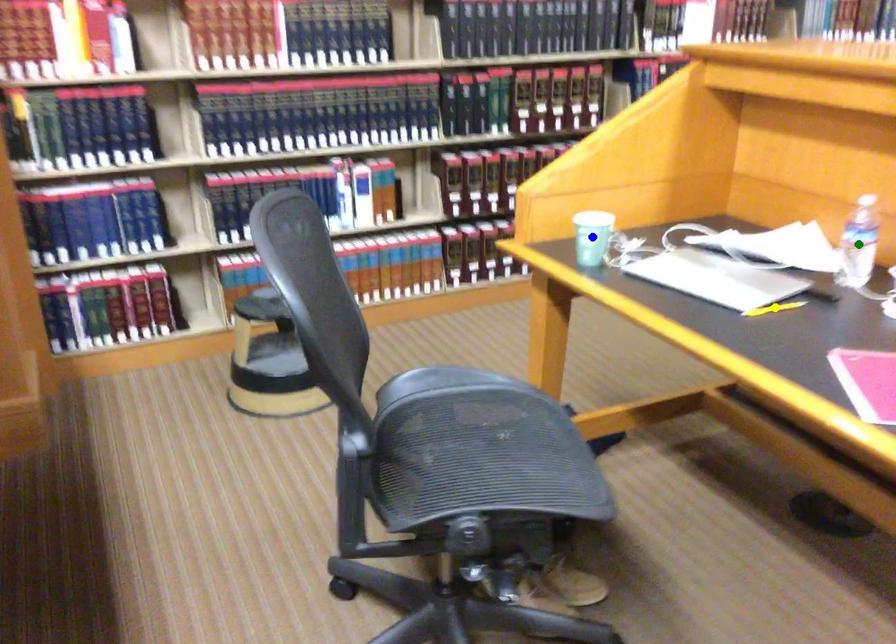
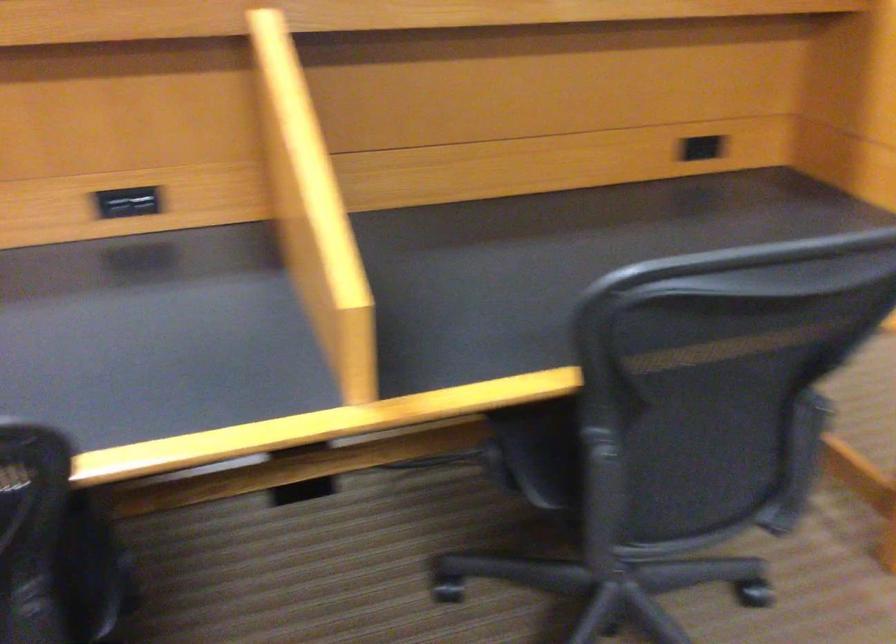
I am providing you with two images of the same scene from different viewpoints. Three points are marked in image1. Which point corresponds to a part or object that is occluded in image2?In image1, three points are marked. Which of them correspond to a part or object that is occluded in image2?Among the three points shown in image1, which one corresponds to a part or object that is no longer visible due to occlusion in image2?

yellow point, green point, blue point cannot be seen in image2.